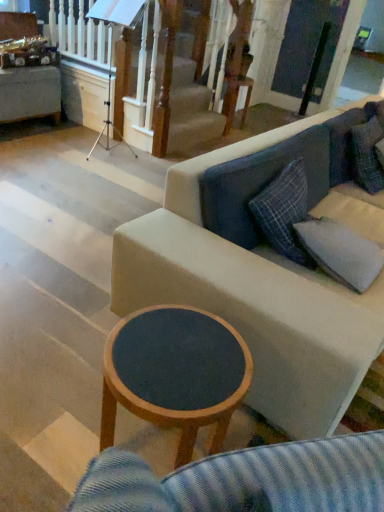
Question: Is wooden round table at upper center shorter than fabric couch at center?

Choices:
 (A) no
 (B) yes

Answer: (B)

Question: Does wooden round table at upper center have a greater height compared to fabric couch at center?

Choices:
 (A) yes
 (B) no

Answer: (B)

Question: Is fabric couch at center surrounded by wooden round table at upper center?

Choices:
 (A) no
 (B) yes

Answer: (A)

Question: Is wooden round table at upper center to the left of fabric couch at center from the viewer's perspective?

Choices:
 (A) yes
 (B) no

Answer: (A)

Question: Can you see wooden round table at upper center touching fabric couch at center?

Choices:
 (A) yes
 (B) no

Answer: (B)

Question: Looking at their shapes, would you say fabric couch at center is wider or thinner than wooden round table at upper center?

Choices:
 (A) thin
 (B) wide

Answer: (B)

Question: In terms of height, does fabric couch at center look taller or shorter compared to wooden round table at upper center?

Choices:
 (A) short
 (B) tall

Answer: (B)

Question: Considering the positions of fabric couch at center and wooden round table at upper center in the image, is fabric couch at center bigger or smaller than wooden round table at upper center?

Choices:
 (A) small
 (B) big

Answer: (B)

Question: From a real-world perspective, relative to wooden round table at upper center, is fabric couch at center vertically above or below?

Choices:
 (A) above
 (B) below

Answer: (A)

Question: Is wooden round table at upper center wider or thinner than gray fabric pillow at right?

Choices:
 (A) wide
 (B) thin

Answer: (A)

Question: Considering the positions of wooden round table at upper center and gray fabric pillow at right in the image, is wooden round table at upper center taller or shorter than gray fabric pillow at right?

Choices:
 (A) short
 (B) tall

Answer: (B)

Question: From a real-world perspective, relative to gray fabric pillow at right, is wooden round table at upper center vertically above or below?

Choices:
 (A) above
 (B) below

Answer: (B)

Question: Is point pyautogui.click(x=241, y=79) closer or farther from the camera than point pyautogui.click(x=342, y=241)?

Choices:
 (A) closer
 (B) farther

Answer: (B)

Question: Relative to fabric couch at center, is gray fabric pillow at right in front or behind?

Choices:
 (A) front
 (B) behind

Answer: (B)

Question: From the image's perspective, is gray fabric pillow at right positioned above or below fabric couch at center?

Choices:
 (A) above
 (B) below

Answer: (B)